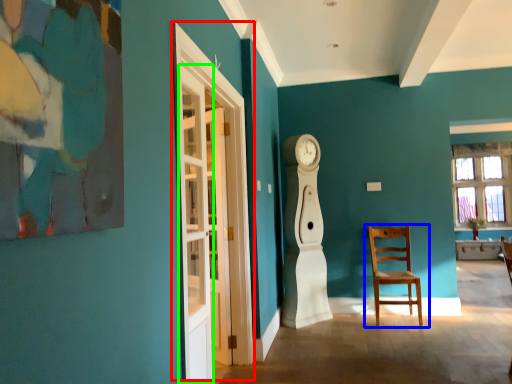
Question: Which is farther away from glass door (highlighted by a red box)? chair (highlighted by a blue box) or glass door (highlighted by a green box)?

Choices:
 (A) chair
 (B) glass door

Answer: (A)